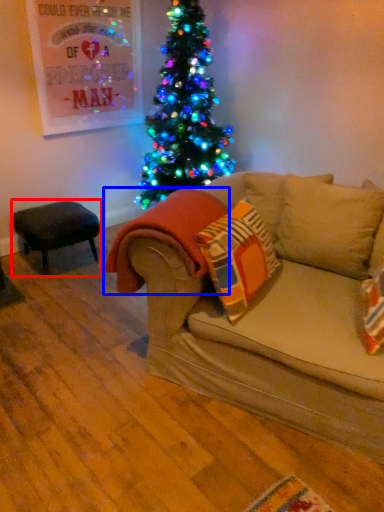
Question: Which of the following is the farthest to the observer, stool (highlighted by a red box) or blanket (highlighted by a blue box)?

Choices:
 (A) stool
 (B) blanket

Answer: (A)